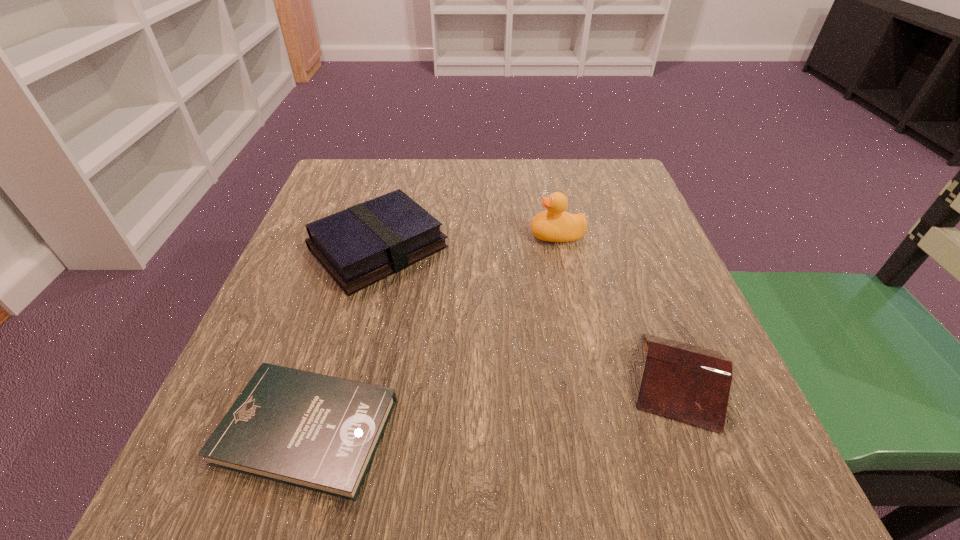
Identify the location of free space located on the front of the tallest book. (318, 474).

Locate an element on the screen. The width and height of the screenshot is (960, 540). vacant area situated 0.090m on the back of the second shortest book is located at coordinates (647, 296).

Locate an element on the screen. blank area located on the back of the shortest object is located at coordinates (369, 230).

The image size is (960, 540). In order to click on object positioned at the far edge in this screenshot , I will do `click(365, 243)`.

This screenshot has height=540, width=960. In order to click on object that is at the near edge in this screenshot , I will do `click(317, 432)`.

Locate an element on the screen. duck that is at the right edge is located at coordinates (554, 224).

Find the location of a particular element. The height and width of the screenshot is (540, 960). book present at the right edge is located at coordinates (688, 383).

Find the location of a particular element. Image resolution: width=960 pixels, height=540 pixels. object that is at the far left corner is located at coordinates pos(365,243).

Image resolution: width=960 pixels, height=540 pixels. I want to click on object that is at the near left corner, so click(x=317, y=432).

In the image, there is a desktop. Where is `free space at the far edge`? This screenshot has width=960, height=540. free space at the far edge is located at coordinates (475, 199).